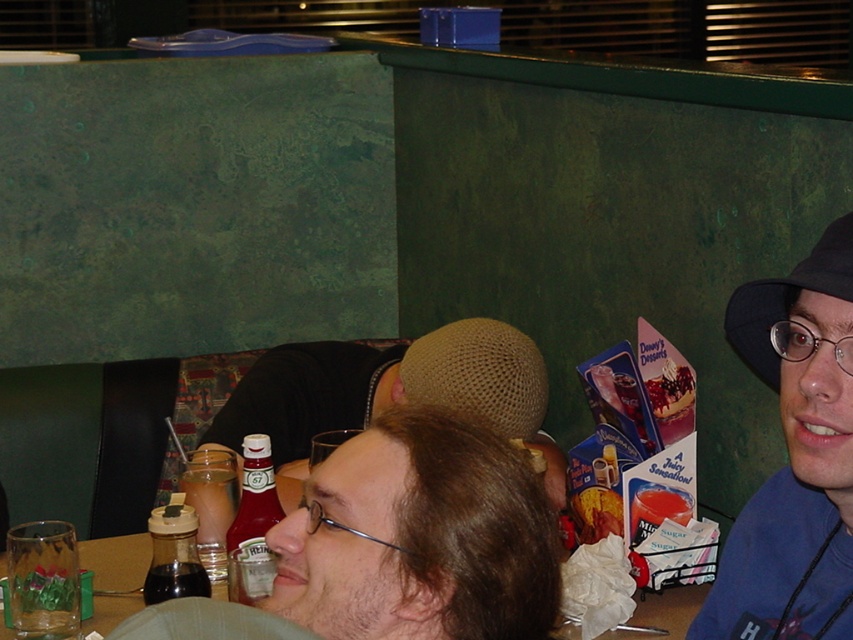
Question: Which point is closer to the camera?

Choices:
 (A) (461, 406)
 (B) (830, 417)
 (C) (811, 288)

Answer: (C)

Question: Which is nearer to the smooth chocolate cake at upper right?

Choices:
 (A) matte plastic bottle at center
 (B) translucent glass table at center
 (C) black fabric baseball hat at right

Answer: (B)

Question: Which object is the closest to the smooth chocolate cake at upper right?

Choices:
 (A) translucent glass table at center
 (B) matte plastic bottle at center

Answer: (A)

Question: Is blue fabric hat at right thinner than brown mesh hat at center?

Choices:
 (A) yes
 (B) no

Answer: (A)

Question: Can you confirm if knitted brown hat at center is bigger than translucent glass table at center?

Choices:
 (A) yes
 (B) no

Answer: (A)

Question: Is matte plastic bottle at center thinner than translucent glass table at center?

Choices:
 (A) yes
 (B) no

Answer: (A)